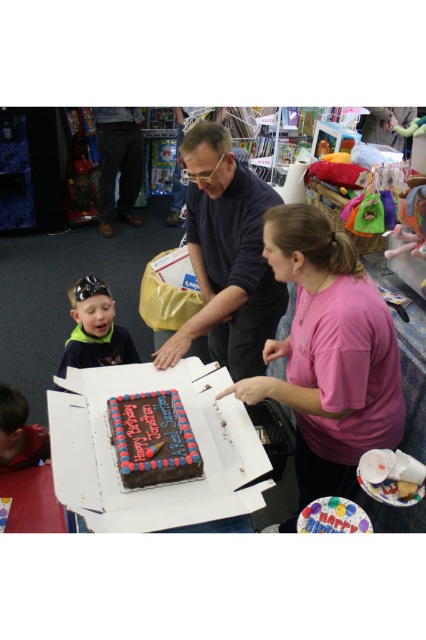
Question: Is pink matte shirt at center positioned behind chocolate frosted cake at center?

Choices:
 (A) yes
 (B) no

Answer: (B)

Question: Is the position of chocolate frosted cake at center less distant than that of smooth red shirt at lower left?

Choices:
 (A) yes
 (B) no

Answer: (A)

Question: Which of these objects is positioned closest to the green jersey at left?

Choices:
 (A) matte cardboard box at center
 (B) pink matte shirt at center

Answer: (B)

Question: Among these points, which one is farthest from the camera?

Choices:
 (A) (80, 328)
 (B) (420, 364)

Answer: (A)

Question: Among these points, which one is nearest to the camera?

Choices:
 (A) (126, 442)
 (B) (328, 304)

Answer: (B)

Question: Can you confirm if matte cardboard box at center is smaller than smooth red shirt at lower left?

Choices:
 (A) yes
 (B) no

Answer: (B)